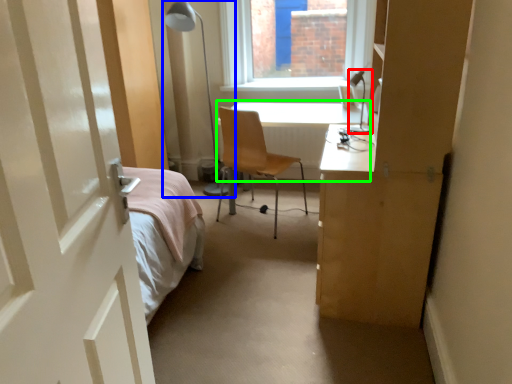
Question: Based on their relative distances, which object is nearer to table lamp (highlighted by a red box)? Choose from table lamp (highlighted by a blue box) and table (highlighted by a green box).

Choices:
 (A) table lamp
 (B) table

Answer: (B)